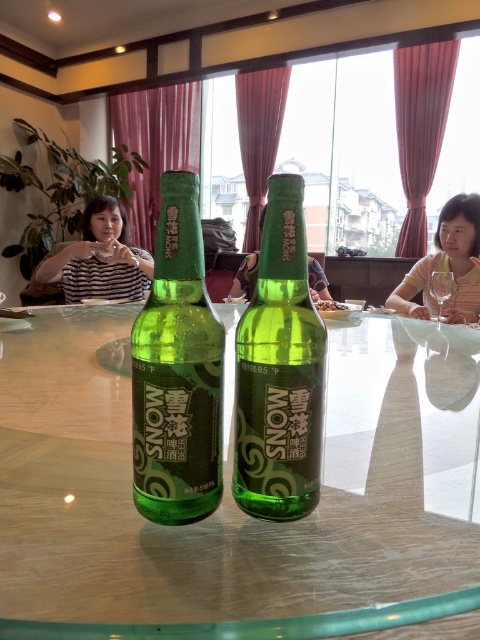
You are a waiter in the restaurant and need to place a menu on the table. The menu is 15 cm wide. The table is 1 meter wide. Where should you place the menu so that it doesn not block the green matte bottle at center?

The green matte bottle at center is located at point (177, 371). Since the table is 1 meter wide, you should place the menu on either side of the bottle, ensuring there is enough space between them so the menu doesn not cover the bottle.

You are a bartender preparing a drink. You have a green matte bottle at center and a transparent glass wine glass at center on the table. Which object has a narrower diameter?

The green matte bottle at center has a narrower diameter than the transparent glass wine glass at center.

You are a server in the restaurant and need to place a 1.2 meter tall cake on the green glass table at center. Can you do it without the cake touching the striped fabric shirt at right?

The green glass table at center is shorter than striped fabric shirt at right. Since the cake is 1.2 meters tall, placing it on the table would make the top of the cake taller than the table but also potentially taller than the striped fabric shirt at right. However, since the shirt is part of a person, the cake might interfere with the person sitting at the right, so it might not be safe to place such a tall cake there.